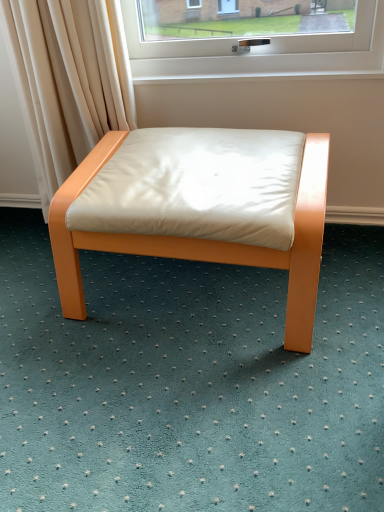
The height and width of the screenshot is (512, 384). I want to click on vacant space underneath white leather stool at center (from a real-world perspective), so click(188, 290).